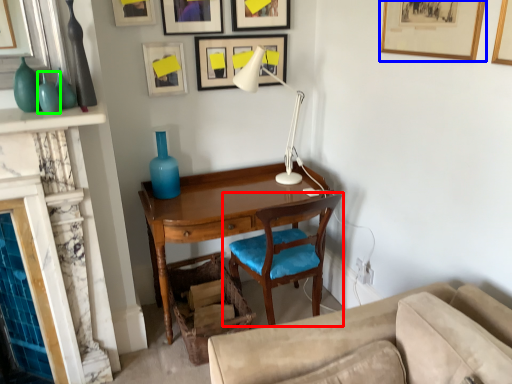
Question: Which is farther away from chair (highlighted by a red box)? picture frame (highlighted by a blue box) or turquoise (highlighted by a green box)?

Choices:
 (A) picture frame
 (B) turquoise

Answer: (B)